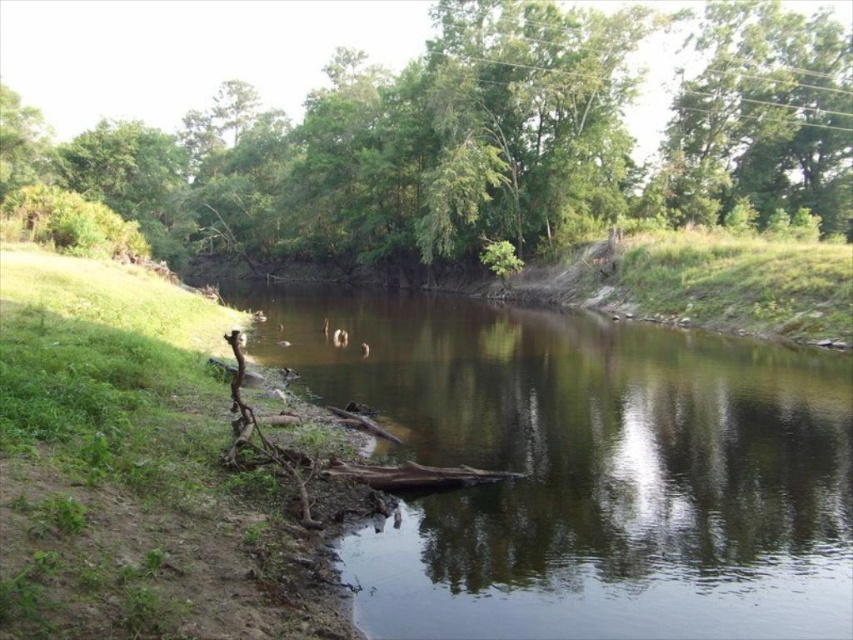
Which of these two, brown dirt river at center or green leafy tree at center, stands taller?

With more height is green leafy tree at center.

Between brown dirt river at center and green leafy tree at center, which one is positioned higher?

Positioned higher is green leafy tree at center.

The height and width of the screenshot is (640, 853). What do you see at coordinates (582, 467) in the screenshot?
I see `brown dirt river at center` at bounding box center [582, 467].

The height and width of the screenshot is (640, 853). In order to click on brown dirt river at center in this screenshot , I will do `click(582, 467)`.